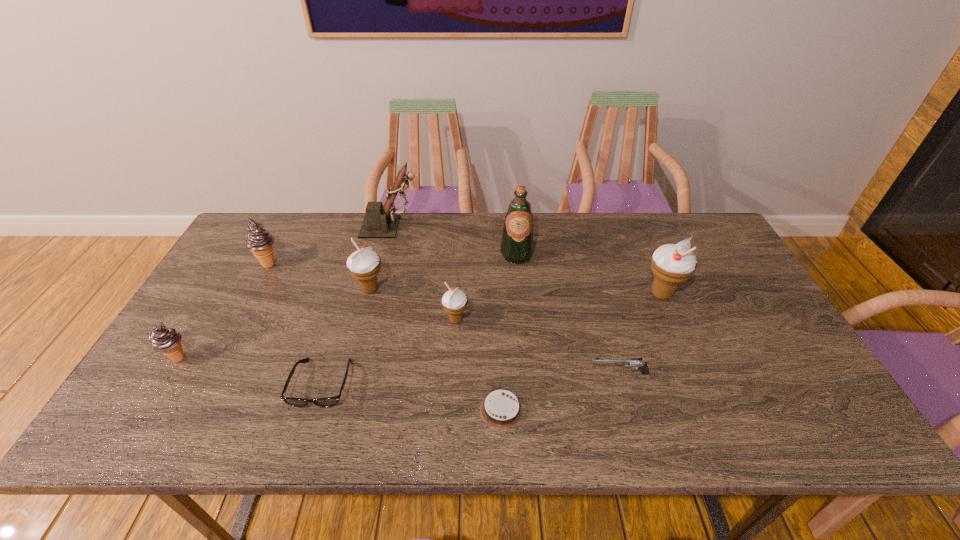
Image resolution: width=960 pixels, height=540 pixels. I want to click on free space between the olive oil and the sixth object from left to right, so click(486, 287).

Select which object appears as the third closest to the olive oil. Please provide its 2D coordinates. Your answer should be formatted as a tuple, i.e. [(x, y)], where the tuple contains the x and y coordinates of a point satisfying the conditions above.

[(672, 264)]

You are a GUI agent. You are given a task and a screenshot of the screen. Output one action in this format:
    pyautogui.click(x=<x>, y=<y>)
    Task: Click on the ninth closest object to the spectacles
    The image size is (960, 540).
    Given the screenshot: What is the action you would take?
    pyautogui.click(x=672, y=264)

Identify which icecream is located as the nearest to the biggest white icecream. Please provide its 2D coordinates. Your answer should be formatted as a tuple, i.e. [(x, y)], where the tuple contains the x and y coordinates of a point satisfying the conditions above.

[(454, 301)]

Identify which icecream is the fourth closest to the second smallest white icecream. Please provide its 2D coordinates. Your answer should be formatted as a tuple, i.e. [(x, y)], where the tuple contains the x and y coordinates of a point satisfying the conditions above.

[(672, 264)]

Locate an element on the screen. The image size is (960, 540). the second closest white icecream relative to the olive oil is located at coordinates (672, 264).

Locate which white icecream ranks third in proximity to the olive oil. Please provide its 2D coordinates. Your answer should be formatted as a tuple, i.e. [(x, y)], where the tuple contains the x and y coordinates of a point satisfying the conditions above.

[(364, 265)]

The image size is (960, 540). I want to click on vacant position in the image that satisfies the following two spatial constraints: 1. on the back side of the shortest object; 2. on the left side of the biggest white icecream, so click(496, 294).

In order to click on vacant space that satisfies the following two spatial constraints: 1. on the front side of the second white icecream from right to left; 2. on the left side of the fourth icecream from right to left in this screenshot , I will do `click(239, 320)`.

This screenshot has width=960, height=540. Find the location of `vacant point that satisfies the following two spatial constraints: 1. on the front-facing side of the brown figurine; 2. on the left side of the second white icecream from left to right`. vacant point that satisfies the following two spatial constraints: 1. on the front-facing side of the brown figurine; 2. on the left side of the second white icecream from left to right is located at coordinates (369, 320).